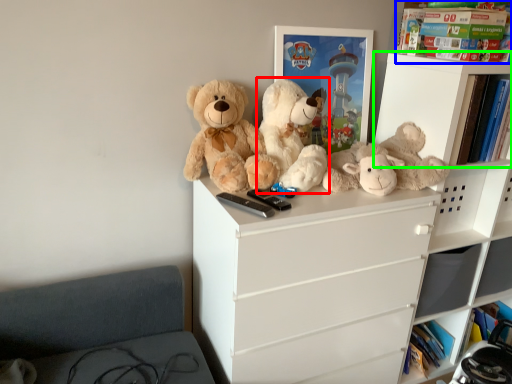
Question: Considering the real-world distances, which object is farthest from teddy bear (highlighted by a red box)? book (highlighted by a blue box) or shelf (highlighted by a green box)?

Choices:
 (A) book
 (B) shelf

Answer: (A)